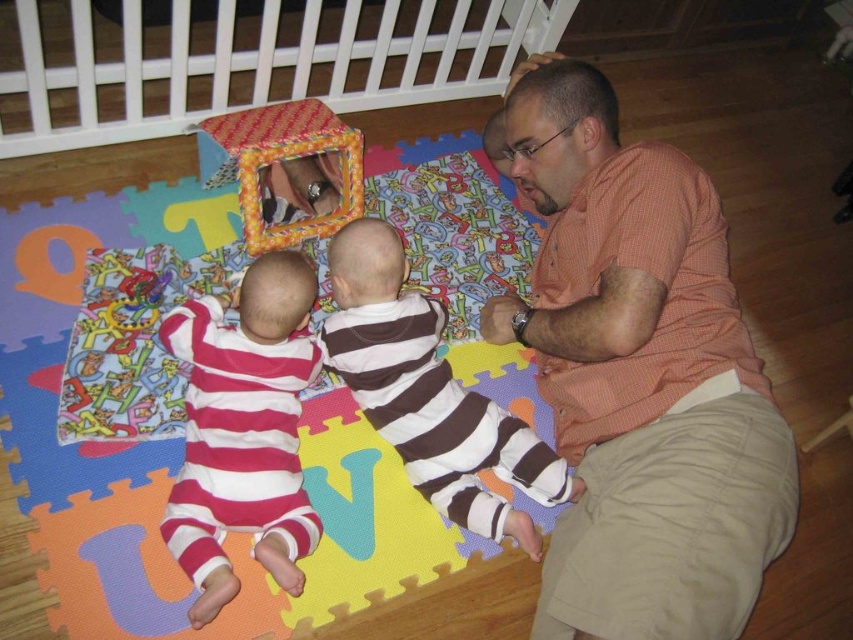
Question: Can you confirm if orange checkered shirt at upper right is wider than brown striped shirt at center?

Choices:
 (A) yes
 (B) no

Answer: (B)

Question: Estimate the real-world distances between objects in this image. Which object is closer to the pink striped onesie at lower left?

Choices:
 (A) plaid fabric cube at upper center
 (B) textured fabric playpen at upper center

Answer: (A)

Question: Does textured fabric playpen at upper center appear over plaid fabric cube at upper center?

Choices:
 (A) yes
 (B) no

Answer: (A)

Question: Can you confirm if brown striped shirt at center is wider than plaid fabric cube at upper center?

Choices:
 (A) yes
 (B) no

Answer: (A)

Question: Which of the following is the closest to the observer?

Choices:
 (A) (703, 513)
 (B) (502, 76)

Answer: (A)

Question: Which point appears farthest from the camera in this image?

Choices:
 (A) (204, 586)
 (B) (704, 272)
 (C) (305, 211)

Answer: (C)